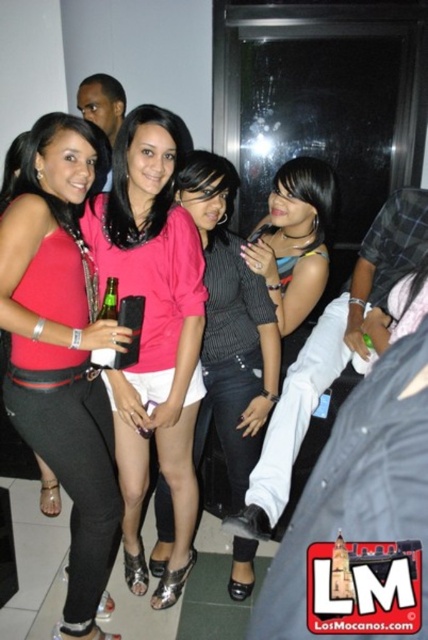
Does matte pink blouse at center appear on the right side of pink matte shirt at center?

Incorrect, matte pink blouse at center is not on the right side of pink matte shirt at center.

Locate an element on the screen. matte pink blouse at center is located at coordinates (61, 349).

Who is higher up, matte pink blouse at center or pink satin blouse at center?

Positioned higher is pink satin blouse at center.

Is point (12, 404) farther from viewer compared to point (184, 460)?

No.

Where is `matte pink blouse at center`? matte pink blouse at center is located at coordinates [x=61, y=349].

Does pink satin blouse at center have a greater width compared to multicolored striped shirt at center?

Yes, pink satin blouse at center is wider than multicolored striped shirt at center.

Describe the element at coordinates (152, 332) in the screenshot. I see `pink satin blouse at center` at that location.

Identify the location of pink satin blouse at center. Image resolution: width=428 pixels, height=640 pixels. (152, 332).